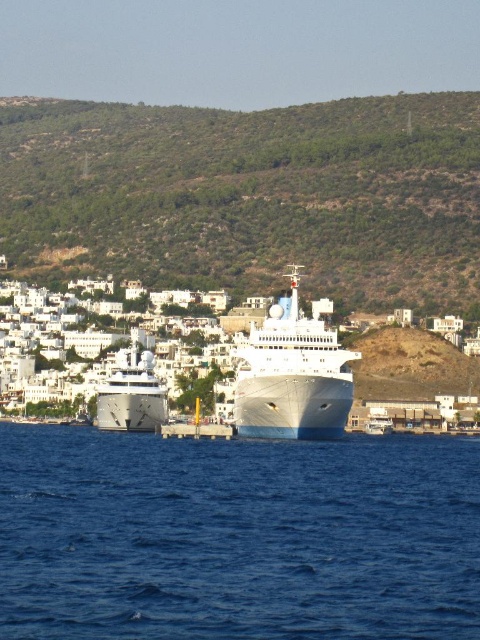
You are a photographer planning to capture the cruise ship and its surroundings. Given that the green grassy hillside at upper center and the white matte building at center are both in the frame, which of these two objects occupies a wider area in the image?

The green grassy hillside at upper center occupies a wider area in the image since its width is larger than that of the white matte building at center.

You are standing at the cruise ship and want to walk towards the white buildings in the background. If you follow the path that goes through both point [236,148] and point [321,305], which point should you reach first?

You should reach point [321,305] first because point [236,148] is behind it.